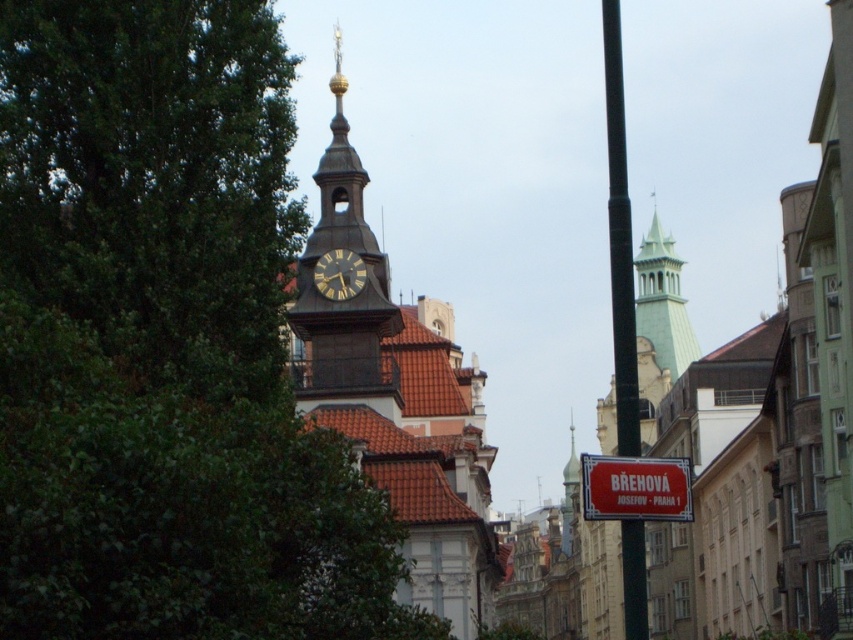
Question: Can you confirm if red plastic street sign at center is wider than green glass spire at upper right?

Choices:
 (A) yes
 (B) no

Answer: (B)

Question: Is green glass spire at upper right wider than wooden clock face at center?

Choices:
 (A) yes
 (B) no

Answer: (A)

Question: Which object is farther from the camera taking this photo?

Choices:
 (A) wooden clock face at center
 (B) green leafy tree at left

Answer: (A)

Question: Which object appears closest to the camera in this image?

Choices:
 (A) wooden clock face at center
 (B) dark brown stone clock tower at center
 (C) green leafy tree at left

Answer: (C)

Question: Which point is closer to the camera taking this photo?

Choices:
 (A) (640, 458)
 (B) (132, 76)
 (C) (329, 276)

Answer: (A)

Question: Where is dark brown stone clock tower at center located in relation to black metal pole at right in the image?

Choices:
 (A) below
 (B) above

Answer: (B)